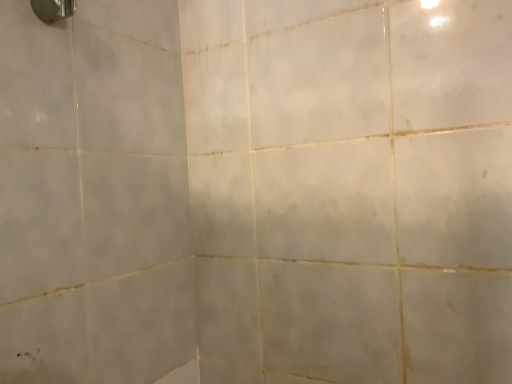
What do you see at coordinates (53, 9) in the screenshot?
I see `metallic silver showerhead at upper left` at bounding box center [53, 9].

Locate an element on the screen. Image resolution: width=512 pixels, height=384 pixels. metallic silver showerhead at upper left is located at coordinates (53, 9).

Locate an element on the screen. metallic silver showerhead at upper left is located at coordinates (53, 9).